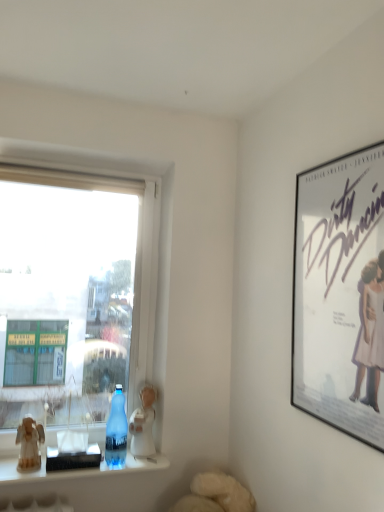
Question: Does transparent glass bottle at window have a smaller size compared to wooden figurine at left, the 1th figurine viewed from the front?

Choices:
 (A) yes
 (B) no

Answer: (B)

Question: Is wooden figurine at left, marked as the second figurine in a back-to-front arrangement, surrounded by transparent glass bottle at window?

Choices:
 (A) yes
 (B) no

Answer: (B)

Question: Considering the relative sizes of transparent glass bottle at window and wooden figurine at left, marked as the second figurine in a back-to-front arrangement, in the image provided, is transparent glass bottle at window bigger than wooden figurine at left, marked as the second figurine in a back-to-front arrangement,?

Choices:
 (A) no
 (B) yes

Answer: (B)

Question: Is transparent glass bottle at window facing away from wooden figurine at left, the 1th figurine viewed from the front?

Choices:
 (A) no
 (B) yes

Answer: (A)

Question: Is transparent glass bottle at window to the right of wooden figurine at left, which ranks as the first figurine in left-to-right order, from the viewer's perspective?

Choices:
 (A) yes
 (B) no

Answer: (A)

Question: Is point (319, 291) closer or farther from the camera than point (150, 419)?

Choices:
 (A) closer
 (B) farther

Answer: (A)

Question: Considering the positions of white matte poster at upper right and white porcelain figurine at lower center, placed as the 1th figurine when sorted from back to front, in the image, is white matte poster at upper right bigger or smaller than white porcelain figurine at lower center, placed as the 1th figurine when sorted from back to front,?

Choices:
 (A) big
 (B) small

Answer: (A)

Question: Is white matte poster at upper right in front of or behind white porcelain figurine at lower center, acting as the second figurine starting from the front, in the image?

Choices:
 (A) front
 (B) behind

Answer: (A)

Question: Is white matte poster at upper right inside the boundaries of white porcelain figurine at lower center, the 2th figurine when ordered from left to right, or outside?

Choices:
 (A) inside
 (B) outside

Answer: (B)

Question: From the image's perspective, is wooden figurine at left, which ranks as the first figurine in left-to-right order, above or below transparent glass window at left?

Choices:
 (A) above
 (B) below

Answer: (B)

Question: Is wooden figurine at left, which ranks as the first figurine in left-to-right order, bigger or smaller than transparent glass window at left?

Choices:
 (A) big
 (B) small

Answer: (B)

Question: From a real-world perspective, relative to transparent glass window at left, is wooden figurine at left, which ranks as the first figurine in left-to-right order, vertically above or below?

Choices:
 (A) below
 (B) above

Answer: (A)

Question: Visually, is wooden figurine at left, which ranks as the first figurine in left-to-right order, positioned to the left or to the right of transparent glass window at left?

Choices:
 (A) right
 (B) left

Answer: (B)

Question: Is transparent glass bottle at window to the left or to the right of white porcelain figurine at lower center, the 2th figurine when ordered from left to right, in the image?

Choices:
 (A) right
 (B) left

Answer: (B)

Question: From the image's perspective, is transparent glass bottle at window above or below white porcelain figurine at lower center, placed as the 1th figurine when sorted from back to front?

Choices:
 (A) above
 (B) below

Answer: (A)